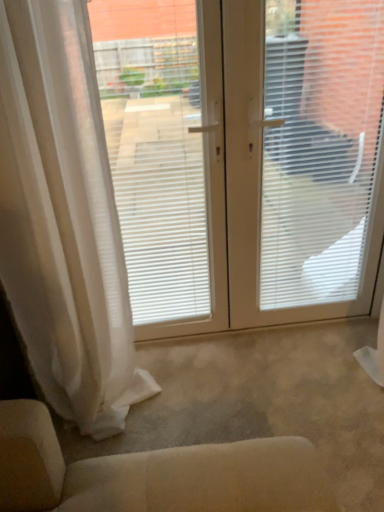
Question: Is white plastic window screen at center, which is counted as the first window screen, starting from the right, outside white matte window blind at center?

Choices:
 (A) no
 (B) yes

Answer: (A)

Question: From the image's perspective, does white plastic window screen at center, which is counted as the first window screen, starting from the right, appear lower than white matte window blind at center?

Choices:
 (A) no
 (B) yes

Answer: (B)

Question: Would you say white matte window blind at center is part of white plastic window screen at center, which is the 2th window screen in left-to-right order,'s contents?

Choices:
 (A) no
 (B) yes

Answer: (B)

Question: Is white plastic window screen at center, which is the 2th window screen in left-to-right order, not near white matte window blind at center?

Choices:
 (A) yes
 (B) no

Answer: (B)

Question: Is white plastic window screen at center, which is counted as the first window screen, starting from the right, aimed at white matte window blind at center?

Choices:
 (A) no
 (B) yes

Answer: (B)

Question: Can you confirm if white plastic window screen at center, which is the 2th window screen in left-to-right order, is thinner than white matte window blind at center?

Choices:
 (A) yes
 (B) no

Answer: (A)

Question: Is white matte window blind at center smaller than white matte window screen at left, marked as the 2th window screen in a right-to-left arrangement?

Choices:
 (A) no
 (B) yes

Answer: (A)

Question: From the image's perspective, is white matte window blind at center on top of white matte window screen at left, marked as the 2th window screen in a right-to-left arrangement?

Choices:
 (A) no
 (B) yes

Answer: (B)

Question: Can you confirm if white matte window blind at center is thinner than white matte window screen at left, which is the first window screen in left-to-right order?

Choices:
 (A) yes
 (B) no

Answer: (A)

Question: Is white matte window blind at center at the left side of white matte window screen at left, which is the first window screen in left-to-right order?

Choices:
 (A) yes
 (B) no

Answer: (B)

Question: From a real-world perspective, is white matte window blind at center on top of white matte window screen at left, which is the first window screen in left-to-right order?

Choices:
 (A) no
 (B) yes

Answer: (A)

Question: Considering the relative positions of white matte window blind at center and white matte window screen at left, which is the first window screen in left-to-right order, in the image provided, is white matte window blind at center behind white matte window screen at left, which is the first window screen in left-to-right order,?

Choices:
 (A) no
 (B) yes

Answer: (B)

Question: Does white plastic window screen at center, which is counted as the first window screen, starting from the right, lie behind white sheer curtain at left?

Choices:
 (A) no
 (B) yes

Answer: (B)